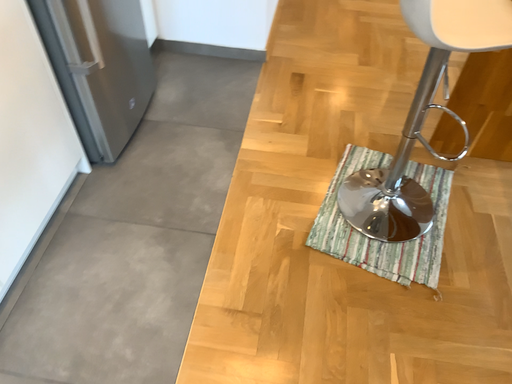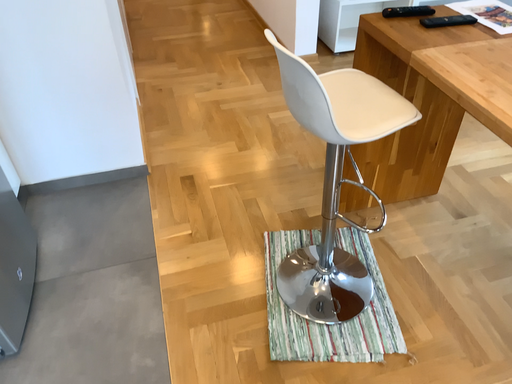
Question: Which way did the camera rotate in the video?

Choices:
 (A) rotated upward
 (B) rotated downward

Answer: (A)